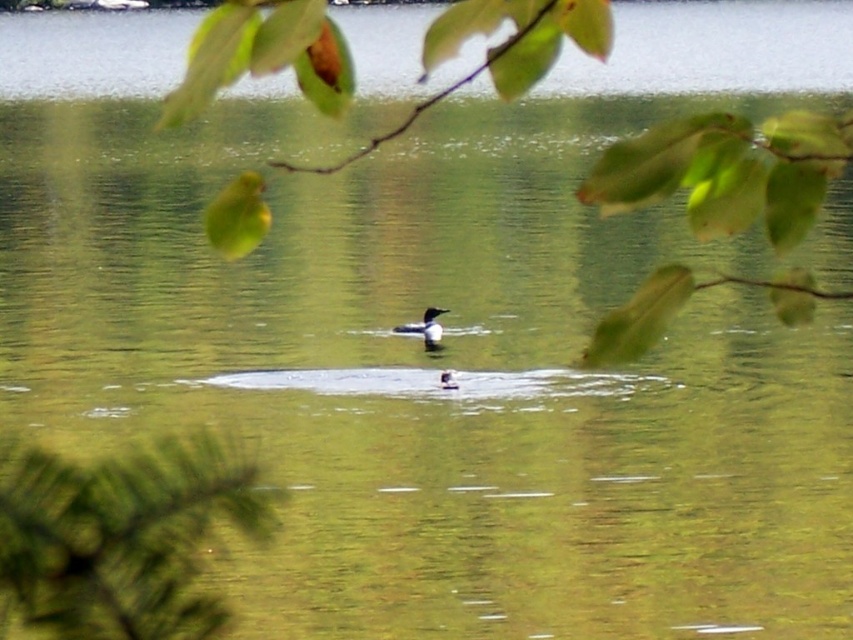
You are an ornithologist observing the dark brown duck at center from a hideout behind the green leafy branch at upper center. Can you fully see the duck without moving the branch?

The green leafy branch at upper center is larger in size than the dark brown duck at center, so the branch may obstruct your view of the duck depending on its position.

You are standing at the edge of the water and see the green leafy branch at upper center and the dark brown duck at center. Which object is positioned to the right of the other?

The green leafy branch at upper center is to the right of the dark brown duck at center.

You are looking at the image and want to know the exact position of the green fuzzy branch at lower left. What are its coordinates?

The green fuzzy branch at lower left is located at coordinates (120, 538).